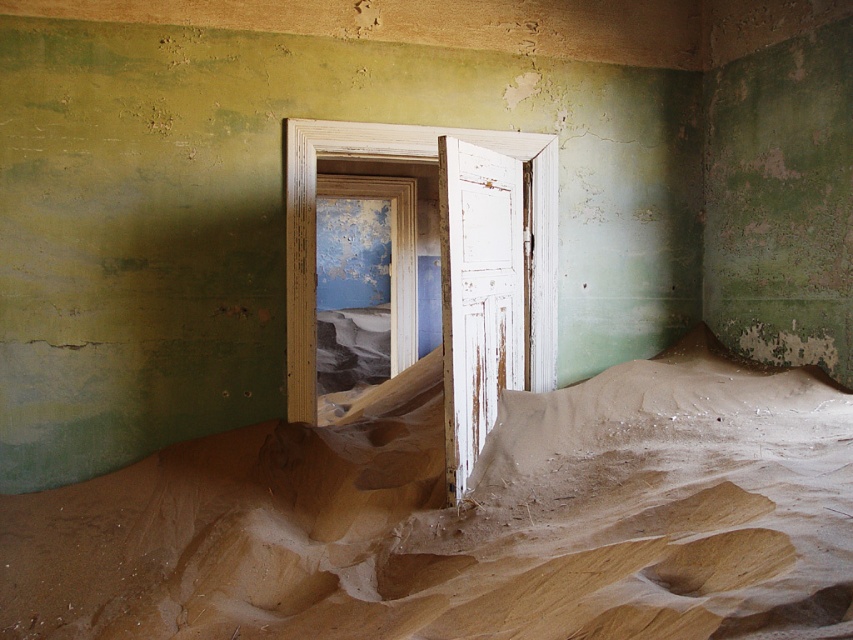
Between sandy beige blanket at center and white weathered wood door at center, which one appears on the right side from the viewer's perspective?

white weathered wood door at center

Between sandy beige blanket at center and white weathered wood door at center, which one has more height?

With more height is white weathered wood door at center.

The image size is (853, 640). In order to click on sandy beige blanket at center in this screenshot , I will do `click(468, 518)`.